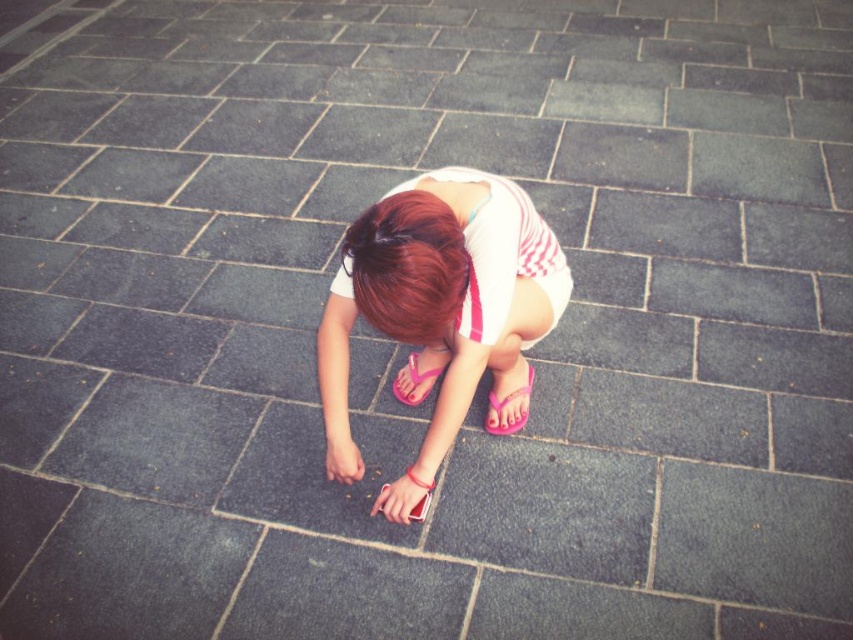
Question: Where is shiny red hair at center located in relation to pink flip-flop at lower center in the image?

Choices:
 (A) right
 (B) left

Answer: (B)

Question: Which point is closer to the camera?

Choices:
 (A) pink rubber sandal at center
 (B) shiny red hair at center
 (C) pink flip-flop at lower center

Answer: (B)

Question: Where is shiny red hair at center located in relation to pink rubber sandal at center in the image?

Choices:
 (A) below
 (B) above

Answer: (B)

Question: Is shiny red hair at center positioned before pink rubber sandal at center?

Choices:
 (A) yes
 (B) no

Answer: (A)

Question: Which object is positioned closest to the pink flip-flop at lower center?

Choices:
 (A) shiny red hair at center
 (B) pink flip-flops at center

Answer: (B)

Question: Which object appears closest to the camera in this image?

Choices:
 (A) shiny red hair at center
 (B) pink rubber sandal at center
 (C) pink flip-flop at lower center
 (D) pink flip-flops at center

Answer: (A)